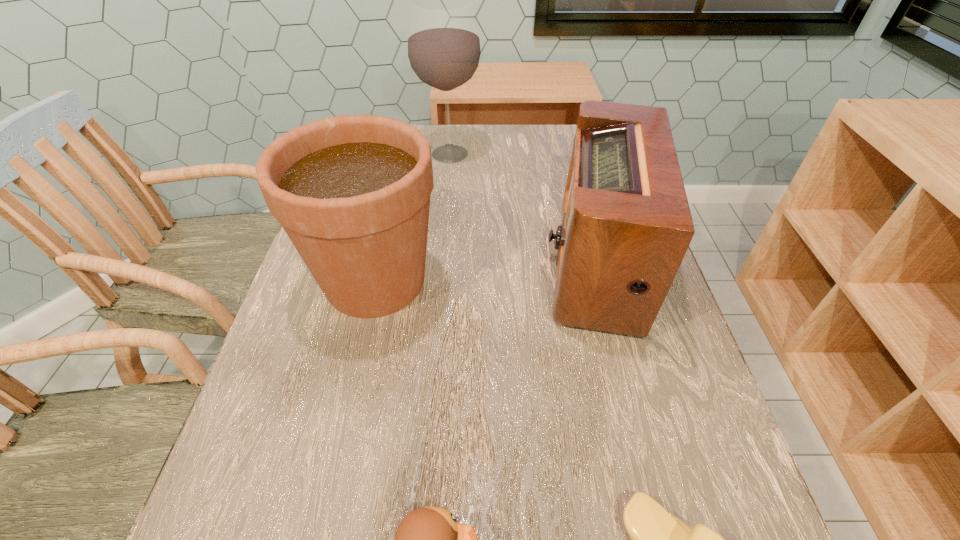
In the image, there is a desktop. Identify the location of free space at the far edge. This screenshot has width=960, height=540. (487, 143).

You are a GUI agent. You are given a task and a screenshot of the screen. Output one action in this format:
    pyautogui.click(x=<x>, y=<y>)
    Task: Click on the free space at the left edge
    Image resolution: width=960 pixels, height=540 pixels.
    Given the screenshot: What is the action you would take?
    pyautogui.click(x=255, y=424)

Identify the location of free space that is in between the radio receiver and the flowerpot. (488, 272).

Find the location of a particular element. The height and width of the screenshot is (540, 960). empty space between the radio receiver and the farthest object is located at coordinates (524, 208).

Locate which object ranks fourth in proximity to the tallest object. Please provide its 2D coordinates. Your answer should be formatted as a tuple, i.e. [(x, y)], where the tuple contains the x and y coordinates of a point satisfying the conditions above.

[(428, 539)]

Locate which object is the third closest to the alcohol. Please provide its 2D coordinates. Your answer should be formatted as a tuple, i.e. [(x, y)], where the tuple contains the x and y coordinates of a point satisfying the conditions above.

[(659, 539)]

Locate an element on the screen. This screenshot has height=540, width=960. free space that satisfies the following two spatial constraints: 1. on the front side of the radio receiver; 2. on the left side of the farthest object is located at coordinates (440, 264).